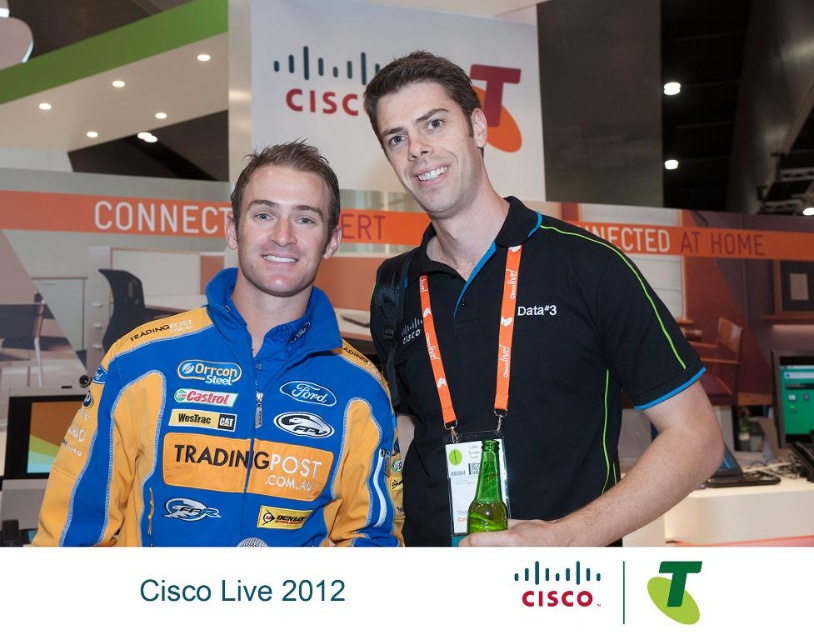
Can you confirm if black polyester polo shirt at center is positioned below green glass bottle at center?

Actually, black polyester polo shirt at center is above green glass bottle at center.

Is black polyester polo shirt at center thinner than green glass bottle at center?

In fact, black polyester polo shirt at center might be wider than green glass bottle at center.

Does point (484, 353) come behind point (484, 467)?

Yes, it is behind point (484, 467).

Identify the location of black polyester polo shirt at center. (523, 340).

Is point (537, 260) positioned in front of point (381, 524)?

No, (537, 260) is further to viewer.

Between black polyester polo shirt at center and blue jersey at center, which one appears on the left side from the viewer's perspective?

blue jersey at center

The height and width of the screenshot is (640, 814). Find the location of `black polyester polo shirt at center`. black polyester polo shirt at center is located at coordinates (523, 340).

This screenshot has width=814, height=640. What are the coordinates of `black polyester polo shirt at center` in the screenshot? It's located at (523, 340).

Based on the photo, is blue jersey at center smaller than green glass bottle at center?

Actually, blue jersey at center might be larger than green glass bottle at center.

Is blue jersey at center closer to camera compared to green glass bottle at center?

No, it is not.

Is point (174, 467) more distant than point (493, 508)?

Yes, point (174, 467) is behind point (493, 508).

At what (x,y) coordinates should I click in order to perform the action: click on blue jersey at center. Please return your answer as a coordinate pair (x, y). This screenshot has height=640, width=814. Looking at the image, I should click on pyautogui.click(x=235, y=401).